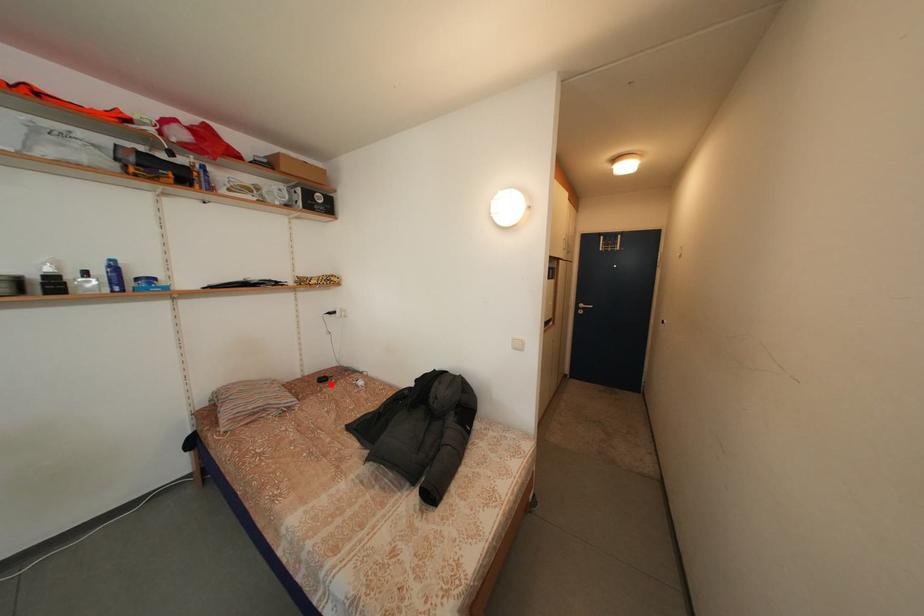
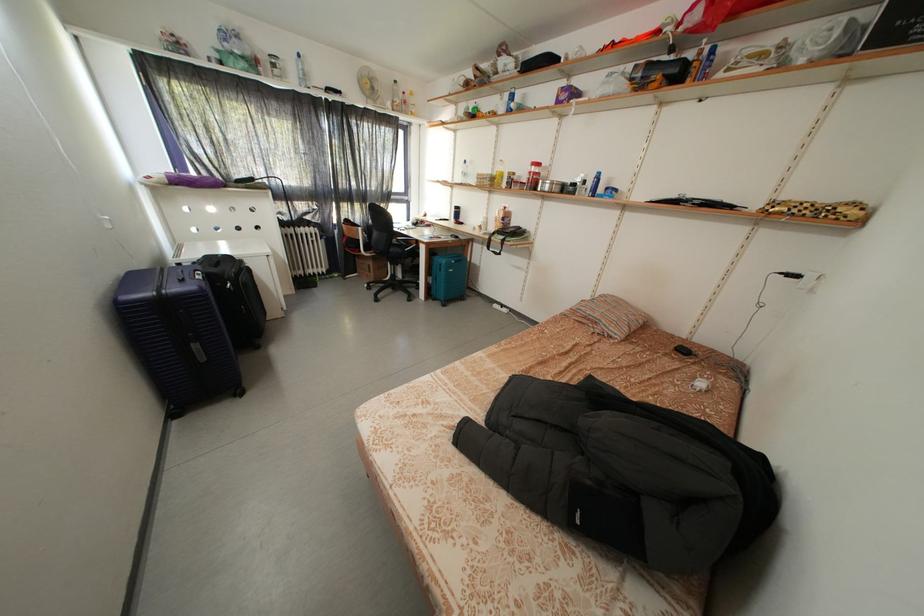
The point at the highlighted location is marked in the first image. Where is the corresponding point in the second image?

(691, 355)